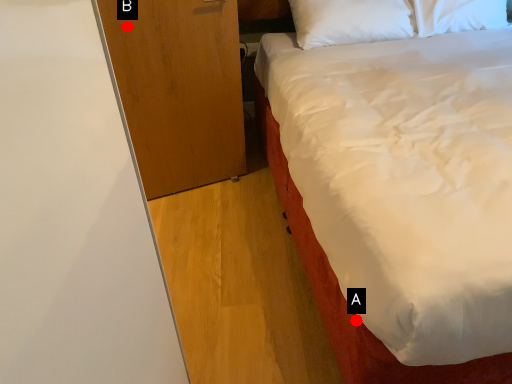
Question: Two points are circled on the image, labeled by A and B beside each circle. Which of the following is the farthest from the observer?

Choices:
 (A) A is further
 (B) B is further

Answer: (B)